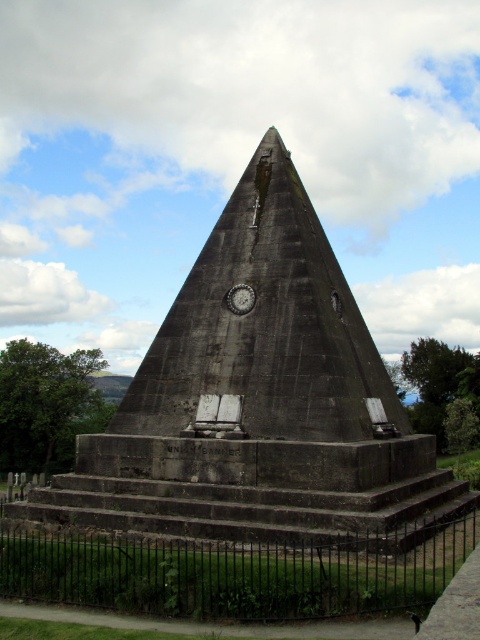
Based on the photo, you are standing at the base of the dark gray stone monument at center and want to see the top of the black wrought iron fence at lower center. Which one do you have to look up to see?

You have to look up to see the top of the dark gray stone monument at center because it is much taller than the black wrought iron fence at lower center.

You are standing at the origin point of a coordinate system placed at the bottom left corner of the image. The dark gray stone monument at center is located at coordinates approximately where?

The dark gray stone monument at center is located at coordinates approximately 0.628 on the x axis and 0.535 on the y axis.

You are standing in front of the pyramid monument and want to reach the point marked at coordinates point (308, 497). If your walking speed is 1.5 meters per second, approximately how many seconds will it take you to reach that point?

The distance between you and the point (308, 497) is 31.89 meters. At a speed of 1.5 meters per second, it will take approximately 21.26 seconds to reach the point.